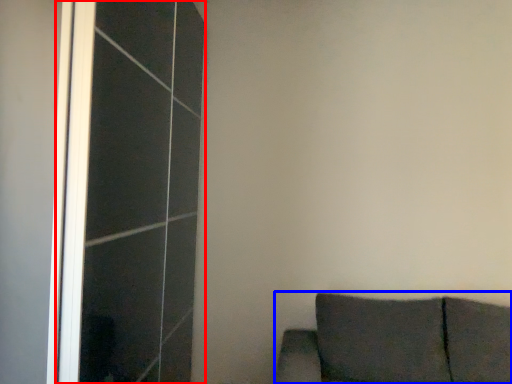
Question: Which object is further to the camera taking this photo, screen door (highlighted by a red box) or furniture (highlighted by a blue box)?

Choices:
 (A) screen door
 (B) furniture

Answer: (A)